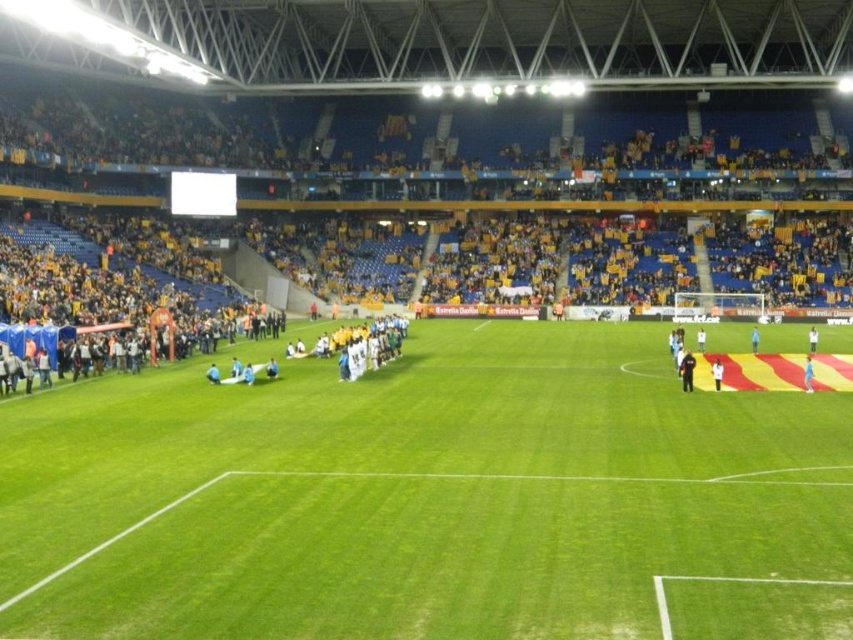
Can you confirm if white cotton shirt at center is positioned to the left of white fabric person at center?

Indeed, white cotton shirt at center is positioned on the left side of white fabric person at center.

Does point (718, 381) come closer to viewer compared to point (815, 337)?

Yes, it is.

Is point (714, 360) less distant than point (808, 346)?

That is True.

This screenshot has width=853, height=640. In order to click on white cotton shirt at center in this screenshot , I will do `click(717, 372)`.

Can you confirm if green grass football field at center is taller than black uniformed official at center?

Yes, green grass football field at center is taller than black uniformed official at center.

Which is in front, point (289, 524) or point (683, 371)?

Point (289, 524) is more forward.

The image size is (853, 640). Describe the element at coordinates (413, 493) in the screenshot. I see `green grass football field at center` at that location.

This screenshot has height=640, width=853. Find the location of `green grass football field at center`. green grass football field at center is located at coordinates (413, 493).

Which of these two, green grass football field at center or white cotton shirt at center, stands shorter?

Standing shorter between the two is white cotton shirt at center.

Is point (523, 461) in front of point (717, 384)?

That is True.

Between point (486, 392) and point (718, 369), which one is positioned in front?

Point (486, 392) is more forward.

The width and height of the screenshot is (853, 640). What are the coordinates of `green grass football field at center` in the screenshot? It's located at (413, 493).